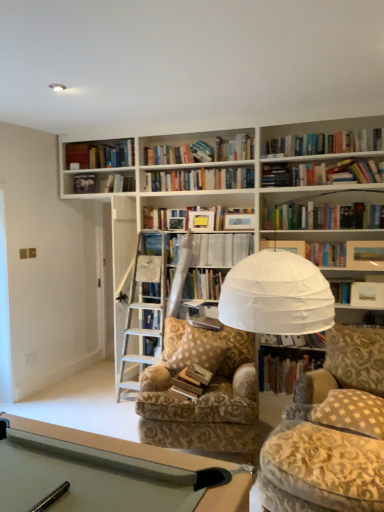
Question: Considering their positions, is brown checkered pillow at center, marked as the 2th pillow in a right-to-left arrangement, located in front of or behind hardcover book at center?

Choices:
 (A) front
 (B) behind

Answer: (A)

Question: In terms of height, does brown checkered pillow at center, the second pillow when ordered from front to back, look taller or shorter compared to hardcover book at center?

Choices:
 (A) tall
 (B) short

Answer: (A)

Question: Based on their relative distances, which object is farther from the patterned fabric chair at center?

Choices:
 (A) hardcover book at center, acting as the 4th book starting from the top
 (B) hardcover book at center
 (C) wooden book at center, the second book in the bottom-to-top sequence
 (D) brown checkered pillow at center, which ranks as the first pillow in left-to-right order
 (E) velvet-patterned swivel chair at lower right

Answer: (A)

Question: Estimate the real-world distances between objects in this image. Which object is farther from the hardcover book at center?

Choices:
 (A) brown checkered pillow at center, marked as the 2th pillow in a right-to-left arrangement
 (B) wooden book at center, marked as the third book in a top-to-bottom arrangement
 (C) white paper book at upper center, marked as the second book in a top-to-bottom arrangement
 (D) velvet-patterned swivel chair at lower right
 (E) white paper at center, the 4th book when ordered from bottom to top

Answer: (D)